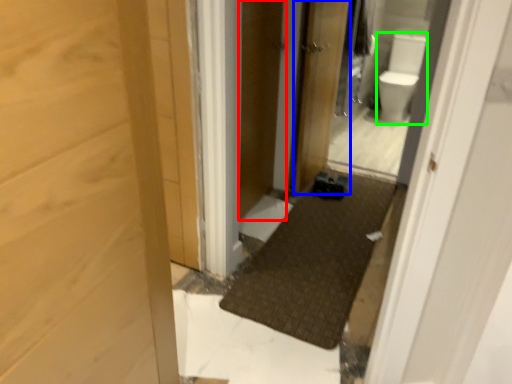
Question: Based on their relative distances, which object is farther from screen door (highlighted by a red box)? Choose from door (highlighted by a blue box) and toilet bowl (highlighted by a green box).

Choices:
 (A) door
 (B) toilet bowl

Answer: (B)